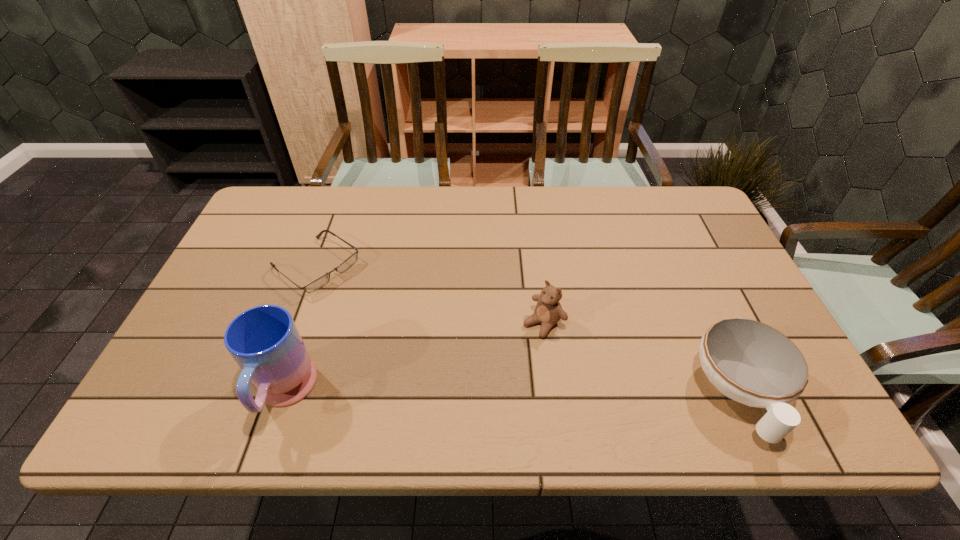
Locate an element on the screen. The width and height of the screenshot is (960, 540). vacant area at the far left corner of the desktop is located at coordinates (309, 207).

The width and height of the screenshot is (960, 540). What are the coordinates of `vacant region between the tallest object and the spectacles` in the screenshot? It's located at (300, 330).

The height and width of the screenshot is (540, 960). Find the location of `vacant region between the spectacles and the teddy bear`. vacant region between the spectacles and the teddy bear is located at coordinates (430, 295).

Find the location of a particular element. vacant space that is in between the mug and the chinaware is located at coordinates (512, 394).

Identify the location of free point between the teddy bear and the spectacles. The image size is (960, 540). (430, 295).

Image resolution: width=960 pixels, height=540 pixels. Identify the location of vacant area that lies between the chinaware and the farthest object. (527, 330).

The image size is (960, 540). I want to click on vacant space in between the third tallest object and the mug, so click(512, 394).

Where is `free space between the chinaware and the shortest object`? This screenshot has width=960, height=540. free space between the chinaware and the shortest object is located at coordinates (527, 330).

This screenshot has height=540, width=960. In order to click on vacant area that lies between the mug and the second object from right to left in this screenshot , I will do `click(414, 359)`.

Where is `vacant area between the second shortest object and the farthest object`? This screenshot has height=540, width=960. vacant area between the second shortest object and the farthest object is located at coordinates (527, 330).